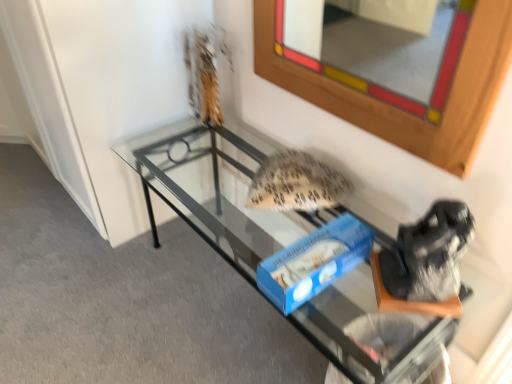
This screenshot has height=384, width=512. Find the location of `free area below transparent glass table at center (from a real-world perspective)`. free area below transparent glass table at center (from a real-world perspective) is located at coordinates (253, 320).